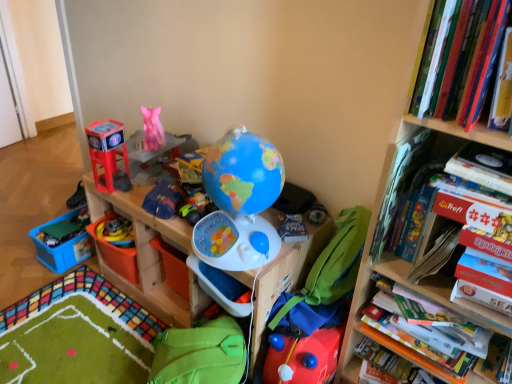
Question: Can we say green plastic toy at lower left, positioned as the 6th toy in right-to-left order, lies outside matte blue fabric bag at center, which appears as the 3th toy when viewed from the right?

Choices:
 (A) yes
 (B) no

Answer: (A)

Question: Does green plastic toy at lower left, which appears as the first toy when viewed from the left, have a lesser width compared to matte blue fabric bag at center, which is counted as the 5th toy, starting from the bottom?

Choices:
 (A) yes
 (B) no

Answer: (B)

Question: Is green plastic toy at lower left, positioned as the 6th toy in right-to-left order, shorter than matte blue fabric bag at center, the 4th toy when ordered from left to right?

Choices:
 (A) no
 (B) yes

Answer: (B)

Question: Could you tell me if green plastic toy at lower left, which appears as the first toy when viewed from the left, is facing matte blue fabric bag at center, the 4th toy when ordered from left to right?

Choices:
 (A) no
 (B) yes

Answer: (A)

Question: Is green plastic toy at lower left, acting as the second toy starting from the bottom, next to matte blue fabric bag at center, the 4th toy when ordered from left to right?

Choices:
 (A) yes
 (B) no

Answer: (B)

Question: In terms of size, does rubberized red toy at lower center, the first toy positioned from the bottom, appear bigger or smaller than hardcover book at upper right, the second book positioned from the top?

Choices:
 (A) big
 (B) small

Answer: (A)

Question: Choose the correct answer: Is rubberized red toy at lower center, which is the 6th toy from top to bottom, inside hardcover book at upper right, marked as the second book in a bottom-to-top arrangement, or outside it?

Choices:
 (A) inside
 (B) outside

Answer: (B)

Question: In the image, is rubberized red toy at lower center, the first toy positioned from the bottom, positioned in front of or behind hardcover book at upper right, marked as the second book in a bottom-to-top arrangement?

Choices:
 (A) front
 (B) behind

Answer: (B)

Question: From a real-world perspective, relative to hardcover book at upper right, the second book positioned from the top, is rubberized red toy at lower center, which is the 6th toy from top to bottom, vertically above or below?

Choices:
 (A) below
 (B) above

Answer: (A)

Question: In terms of height, does green fabric bean bag at lower center, positioned as the 1th bean bag chair in bottom-to-top order, look taller or shorter compared to blue plastic globe at center?

Choices:
 (A) short
 (B) tall

Answer: (A)

Question: In terms of width, does green fabric bean bag at lower center, the 2th bean bag chair when ordered from top to bottom, look wider or thinner when compared to blue plastic globe at center?

Choices:
 (A) wide
 (B) thin

Answer: (B)

Question: From a real-world perspective, is green fabric bean bag at lower center, which is the 1th bean bag chair from left to right, physically located above or below blue plastic globe at center?

Choices:
 (A) below
 (B) above

Answer: (A)

Question: Does point (186, 355) appear closer or farther from the camera than point (159, 306)?

Choices:
 (A) closer
 (B) farther

Answer: (A)

Question: From their relative heights in the image, would you say rubber yellow toy at lower left, which ranks as the third toy in bottom-to-top order, is taller or shorter than wooden toy storage at center?

Choices:
 (A) tall
 (B) short

Answer: (B)

Question: Is rubber yellow toy at lower left, arranged as the second toy when viewed from the left, spatially inside wooden toy storage at center, or outside of it?

Choices:
 (A) outside
 (B) inside

Answer: (B)